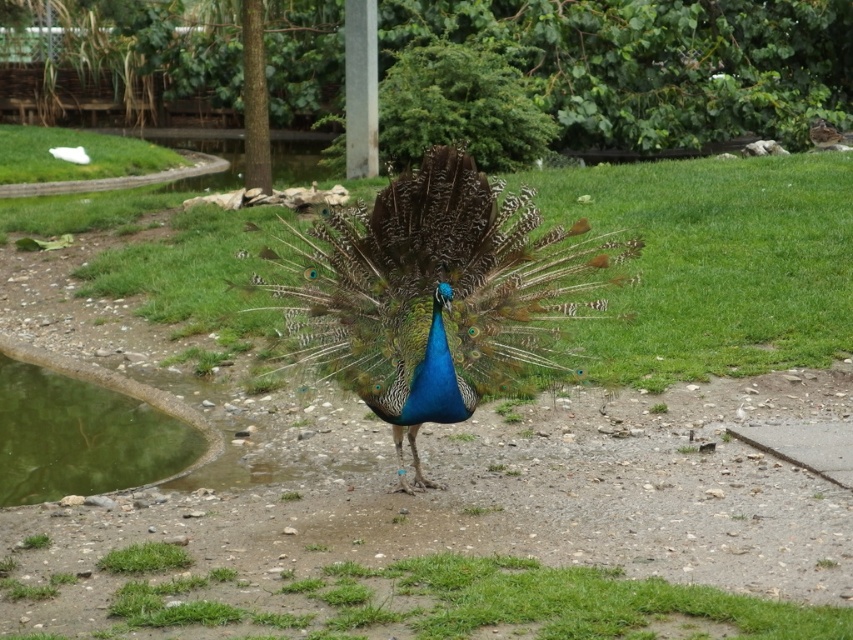
Question: Which point is closer to the camera?

Choices:
 (A) green grass at center
 (B) shiny blue peacock at center
 (C) green reflective water at lower left

Answer: (A)

Question: Which of these objects is positioned farthest from the green reflective water at lower left?

Choices:
 (A) shiny blue peacock at center
 (B) green grass at center

Answer: (B)

Question: Is shiny blue peacock at center smaller than green reflective water at lower left?

Choices:
 (A) yes
 (B) no

Answer: (A)

Question: Which object is positioned farthest from the green grass at center?

Choices:
 (A) shiny blue peacock at center
 (B) green reflective water at lower left

Answer: (B)

Question: Does shiny blue peacock at center come in front of green grass at center?

Choices:
 (A) no
 (B) yes

Answer: (A)

Question: Is green grass at center thinner than green reflective water at lower left?

Choices:
 (A) yes
 (B) no

Answer: (B)